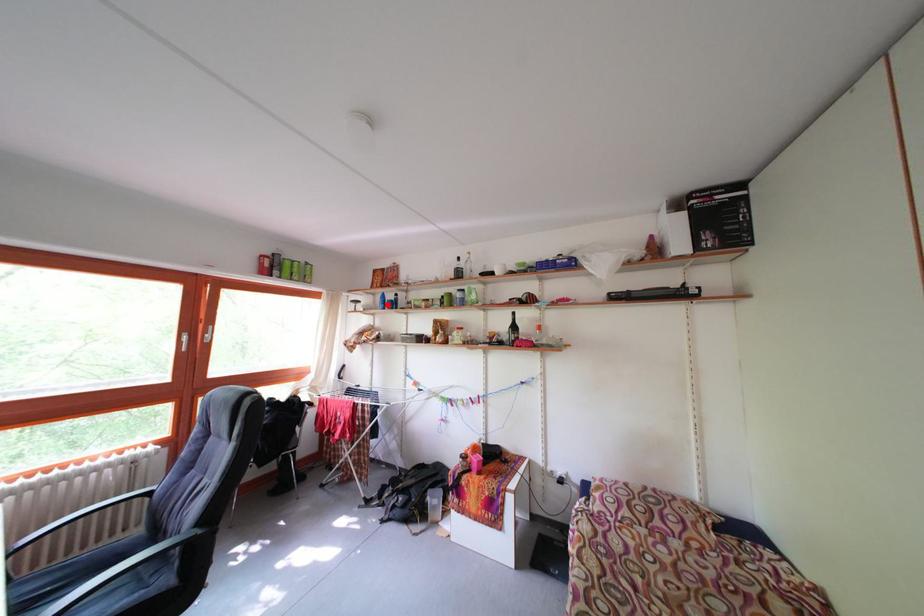
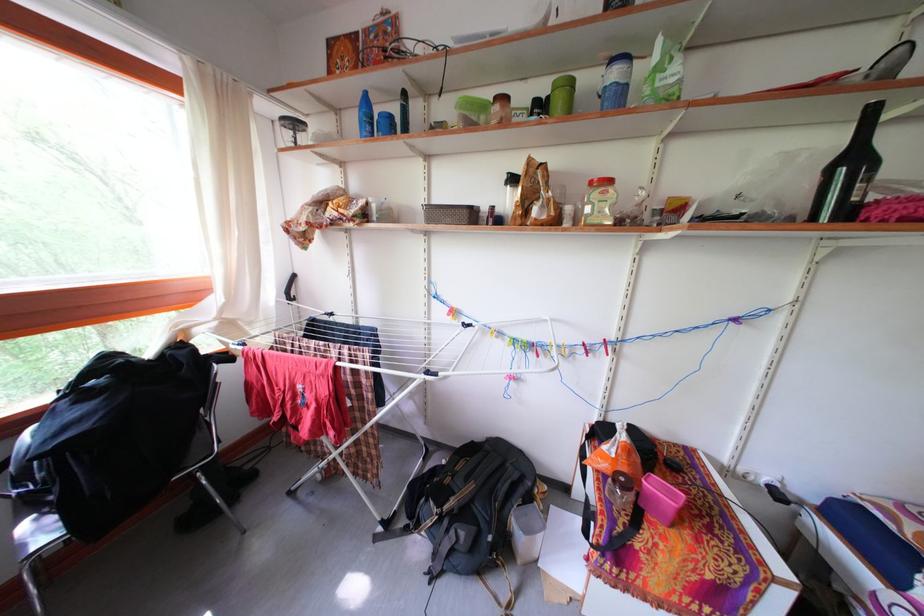
Locate, in the second image, the point that corresponds to the highlighted location in the first image.

(360, 126)